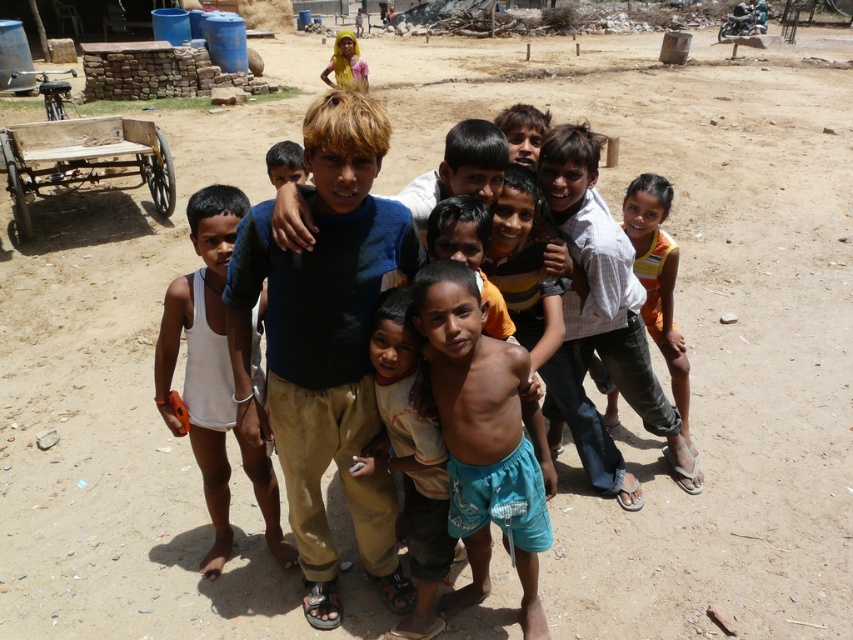
Between point (335, 198) and point (213, 308), which one is positioned behind?

The point (213, 308) is behind.

You are a GUI agent. You are given a task and a screenshot of the screen. Output one action in this format:
    pyautogui.click(x=<x>, y=<y>)
    Task: Click on the blue cotton shirt at center
    The image size is (853, 640).
    Given the screenshot: What is the action you would take?
    pyautogui.click(x=325, y=342)

Can you confirm if white cotton tank top at left is smaller than orange sleeveless top at right?

Actually, white cotton tank top at left might be larger than orange sleeveless top at right.

Is white cotton tank top at left thinner than orange sleeveless top at right?

No.

Is point (216, 412) farther from camera compared to point (666, 202)?

No, (216, 412) is closer to viewer.

Identify the location of white cotton tank top at left. The image size is (853, 640). (212, 376).

Between point (494, 388) and point (224, 268), which one is positioned in front?

Point (494, 388)

Between blue cotton shorts at center and white cotton tank top at left, which one is positioned higher?

white cotton tank top at left is higher up.

Is point (439, 326) behind point (223, 257)?

No, it is in front of (223, 257).

Where is `blue cotton shorts at center`? blue cotton shorts at center is located at coordinates (482, 438).